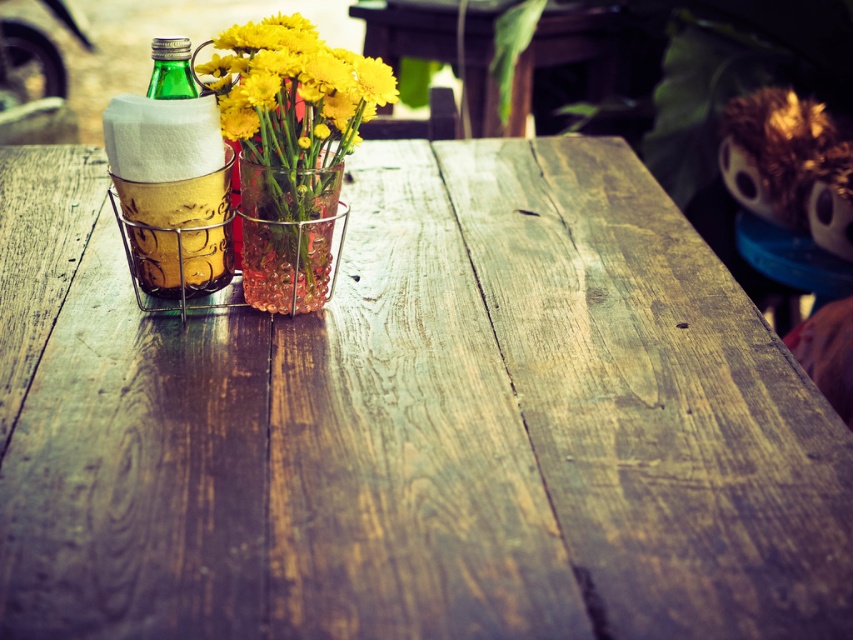
Question: In this image, where is green glass bottle at left located relative to translucent glass vase at center?

Choices:
 (A) right
 (B) left

Answer: (B)

Question: Is translucent glass vase at center to the left of clear glass vase at center from the viewer's perspective?

Choices:
 (A) no
 (B) yes

Answer: (A)

Question: Which point appears closest to the camera in this image?

Choices:
 (A) (171, 88)
 (B) (248, 264)
 (C) (212, 129)

Answer: (C)

Question: From the image, what is the correct spatial relationship of green glass bottle at left in relation to translucent glass vase at center?

Choices:
 (A) right
 (B) left

Answer: (B)

Question: Which point appears closest to the camera in this image?

Choices:
 (A) (161, 65)
 (B) (294, 134)
 (C) (169, 68)
 (D) (328, 224)

Answer: (B)

Question: Which object is positioned farthest from the translucent glass vase at center?

Choices:
 (A) green glass bottle at left
 (B) clear glass vase at center

Answer: (A)